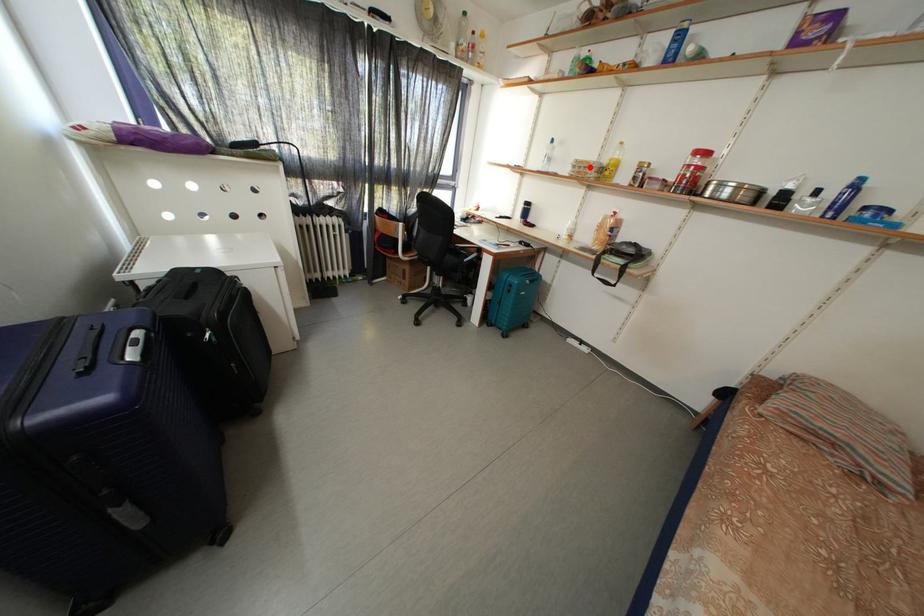
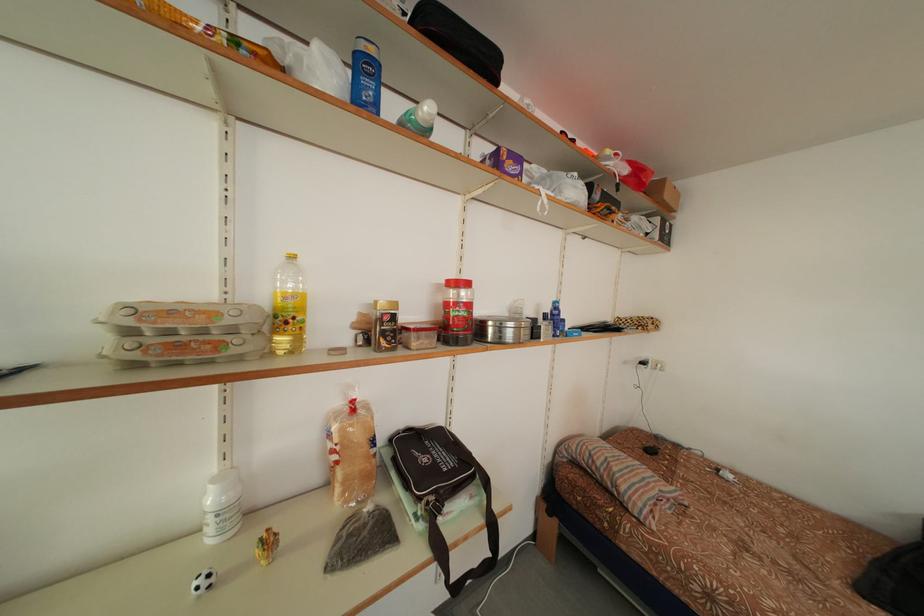
Where in the second image is the point corresponding to the highlighted location from the first image?

(178, 317)